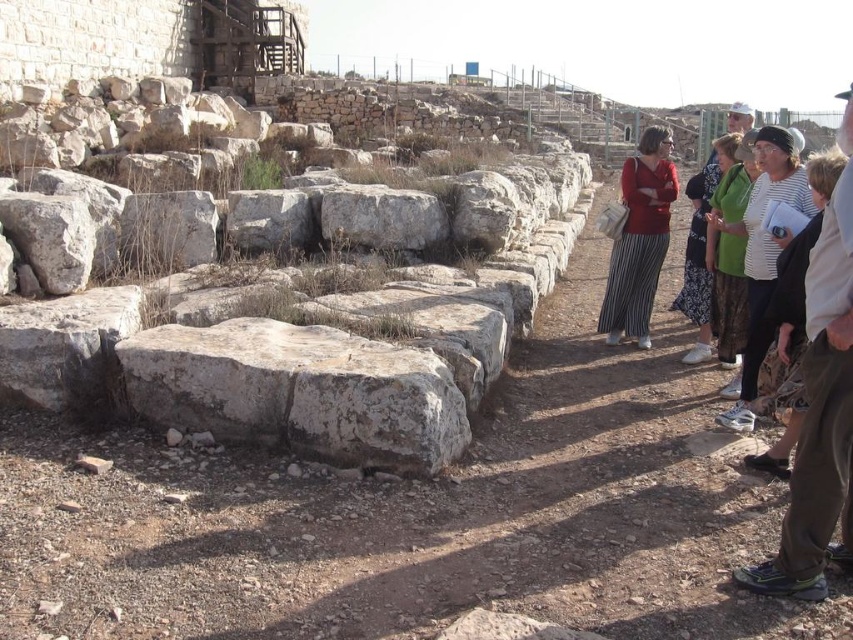
Looking at this image, you are a visitor at the archaeological site and notice two people wearing the striped fabric jacket at right and the green textured sweater at right. From your perspective, which clothing item is positioned lower on their bodies?

The striped fabric jacket at right is located below the green textured sweater at right, so the striped fabric jacket at right is positioned lower on their bodies.

You are an archaeologist at the site and need to move the green textured sweater at right to the gray stone boulder at left. Can you place the sweater on top of the boulder?

The gray stone boulder at left is larger in size than the green textured sweater at right, so yes, the sweater can be placed on top of the boulder since it is smaller and the boulder provides enough surface area.

You are an archaeologist standing at the center of the site, and you need to retrieve both the striped fabric jacket at right and the green textured sweater at right. If your reach is 2 meters, can you grab both items without moving?

The striped fabric jacket at right is 2.50 meters from the green textured sweater at right, which is beyond your 2 meter reach. You cannot grab both items without moving.